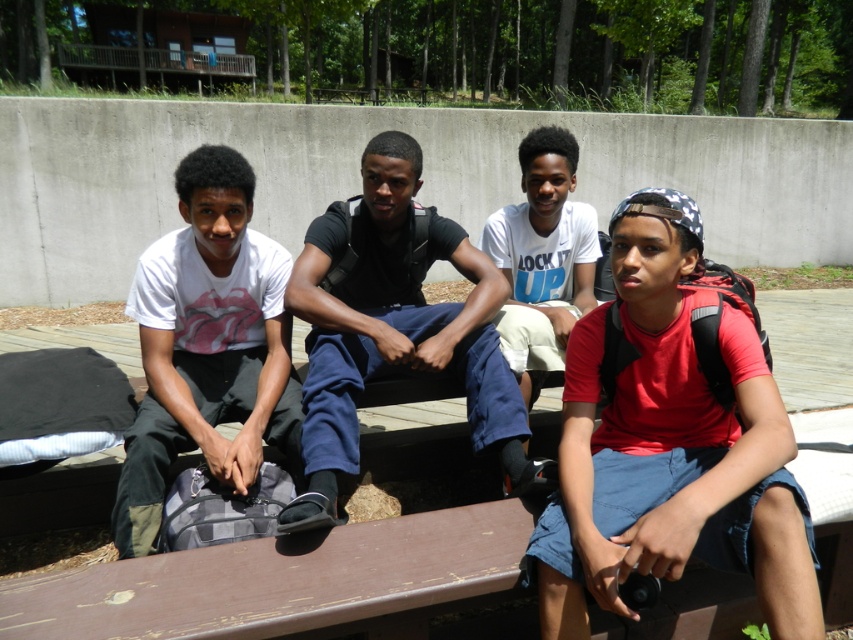
Question: Can you confirm if red matte shirt at right is wider than brown wooden bench at center?

Choices:
 (A) yes
 (B) no

Answer: (B)

Question: Can you confirm if white matte t-shirt at left is wider than white cotton shirt at center?

Choices:
 (A) no
 (B) yes

Answer: (B)

Question: Which object appears farthest from the camera in this image?

Choices:
 (A) white matte t-shirt at left
 (B) brown wooden bench at center

Answer: (A)

Question: Which object is farther from the camera taking this photo?

Choices:
 (A) dark blue jeans at center
 (B) brown wooden bench at center
 (C) white cotton shirt at center

Answer: (C)

Question: Can you confirm if brown wooden bench at center is bigger than white matte t-shirt at left?

Choices:
 (A) yes
 (B) no

Answer: (B)

Question: Estimate the real-world distances between objects in this image. Which object is closer to the dark blue jeans at center?

Choices:
 (A) white cotton shirt at center
 (B) brown wooden bench at center
 (C) white matte t-shirt at left

Answer: (C)